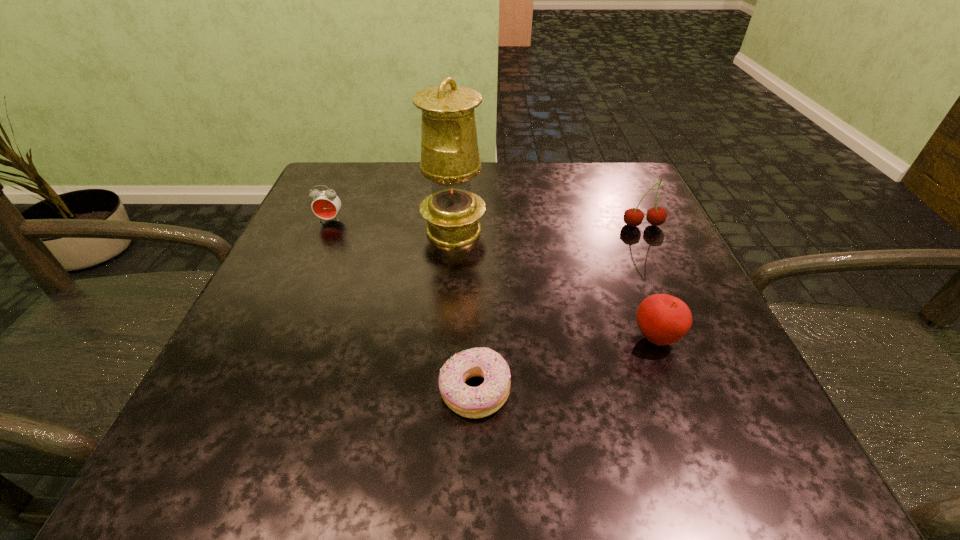
I want to click on oil lamp, so click(x=450, y=158).

Where is `the second tallest object`? Image resolution: width=960 pixels, height=540 pixels. the second tallest object is located at coordinates coord(633,217).

Find the location of a particular element. Image resolution: width=960 pixels, height=540 pixels. alarm clock is located at coordinates (326, 204).

At what (x,y) coordinates should I click in order to perform the action: click on apple. Please return your answer as a coordinate pair (x, y). The image size is (960, 540). Looking at the image, I should click on (663, 319).

Where is `the shortest object`? The height and width of the screenshot is (540, 960). the shortest object is located at coordinates (471, 402).

I want to click on the nearest object, so click(471, 402).

Identify the location of blank area located 0.070m on the back of the tallest object. (456, 195).

Find the location of `vacant space located 0.300m on the surface of the second tallest object`. vacant space located 0.300m on the surface of the second tallest object is located at coordinates (699, 345).

Image resolution: width=960 pixels, height=540 pixels. Identify the location of free space located on the face of the alarm clock. click(260, 380).

Where is `free space located on the back of the apple`? This screenshot has height=540, width=960. free space located on the back of the apple is located at coordinates (635, 282).